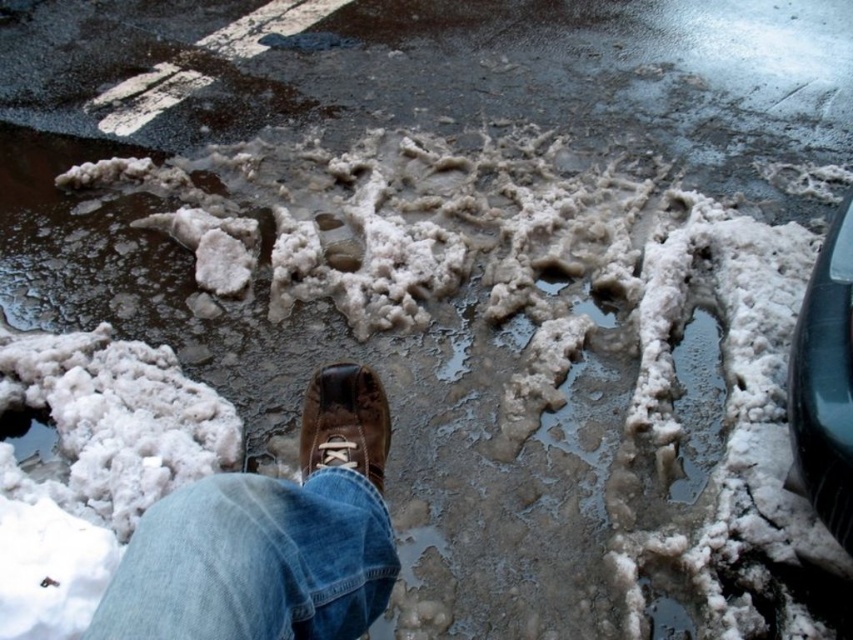
Does brown leather boot at center have a lesser height compared to brown leather shoe at center?

In fact, brown leather boot at center may be taller than brown leather shoe at center.

This screenshot has height=640, width=853. What do you see at coordinates (270, 538) in the screenshot?
I see `brown leather boot at center` at bounding box center [270, 538].

Which is in front, point (200, 481) or point (381, 385)?

Point (200, 481) is more forward.

Locate an element on the screen. This screenshot has height=640, width=853. brown leather boot at center is located at coordinates click(270, 538).

Who is more forward, (265, 560) or (846, 250)?

Point (265, 560) is more forward.

Which of these two, brown leather boot at center or shiny black car at right, stands taller?

Standing taller between the two is shiny black car at right.

Which is behind, point (312, 548) or point (833, 310)?

Positioned behind is point (833, 310).

Locate an element on the screen. The width and height of the screenshot is (853, 640). brown leather boot at center is located at coordinates tap(270, 538).

Which is in front, point (844, 308) or point (383, 454)?

Point (844, 308) is in front.

From the picture: Between shiny black car at right and brown leather shoe at center, which one has more height?

Standing taller between the two is shiny black car at right.

Is point (792, 349) less distant than point (343, 385)?

That is False.

Where is `shiny black car at right`? shiny black car at right is located at coordinates (825, 381).